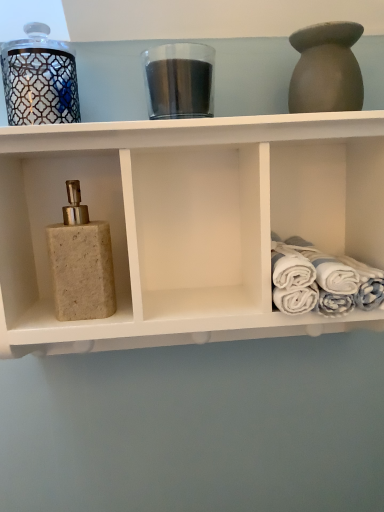
Question: Can you confirm if beige stone soap dispenser at left is bigger than matte clay vase at upper right?

Choices:
 (A) yes
 (B) no

Answer: (A)

Question: From a real-world perspective, is beige stone soap dispenser at left positioned over matte clay vase at upper right based on gravity?

Choices:
 (A) no
 (B) yes

Answer: (A)

Question: Does beige stone soap dispenser at left have a lesser width compared to matte clay vase at upper right?

Choices:
 (A) no
 (B) yes

Answer: (B)

Question: Is the surface of beige stone soap dispenser at left in direct contact with matte clay vase at upper right?

Choices:
 (A) no
 (B) yes

Answer: (A)

Question: Can you confirm if beige stone soap dispenser at left is wider than matte clay vase at upper right?

Choices:
 (A) yes
 (B) no

Answer: (B)

Question: Considering the relative positions of beige stone soap dispenser at left and matte clay vase at upper right in the image provided, is beige stone soap dispenser at left to the right of matte clay vase at upper right from the viewer's perspective?

Choices:
 (A) yes
 (B) no

Answer: (B)

Question: Is beige stone soap dispenser at left taller than metallic glass candle at upper left, the first glass jar when ordered from left to right?

Choices:
 (A) no
 (B) yes

Answer: (B)

Question: Can you confirm if beige stone soap dispenser at left is bigger than metallic glass candle at upper left, the first glass jar when ordered from left to right?

Choices:
 (A) no
 (B) yes

Answer: (B)

Question: From a real-world perspective, is beige stone soap dispenser at left on top of metallic glass candle at upper left, the first glass jar when ordered from left to right?

Choices:
 (A) yes
 (B) no

Answer: (B)

Question: Could you tell me if beige stone soap dispenser at left is facing metallic glass candle at upper left, the first glass jar when ordered from left to right?

Choices:
 (A) no
 (B) yes

Answer: (A)

Question: From the image's perspective, is beige stone soap dispenser at left over metallic glass candle at upper left, the second glass jar from the right?

Choices:
 (A) no
 (B) yes

Answer: (A)

Question: Is beige stone soap dispenser at left thinner than metallic glass candle at upper left, the second glass jar from the right?

Choices:
 (A) no
 (B) yes

Answer: (B)

Question: Is beige stone soap dispenser at left directly adjacent to beige stone soap dispenser at left?

Choices:
 (A) no
 (B) yes

Answer: (A)